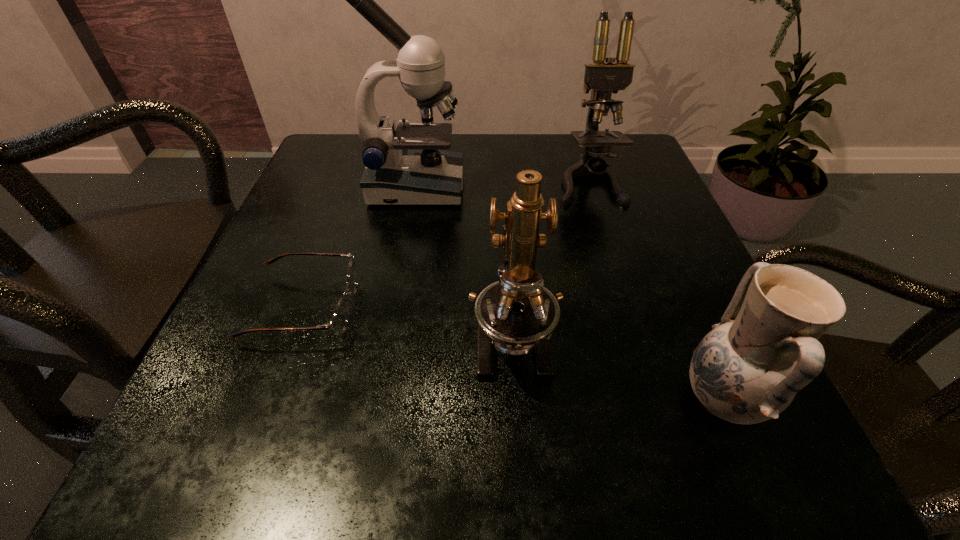
The image size is (960, 540). I want to click on the second closest object relative to the shortest object, so click(x=517, y=314).

Locate which microscope ranks second in proximity to the leftmost microscope. Please provide its 2D coordinates. Your answer should be formatted as a tuple, i.e. [(x, y)], where the tuple contains the x and y coordinates of a point satisfying the conditions above.

[(517, 314)]

Where is `the second closest microscope relative to the nearest microscope`? the second closest microscope relative to the nearest microscope is located at coordinates (603, 79).

Where is `vacant space that satisfies the following two spatial constraints: 1. at the eyepieces of the rightmost microscope; 2. at the eyepiece of the tallest microscope`? The width and height of the screenshot is (960, 540). vacant space that satisfies the following two spatial constraints: 1. at the eyepieces of the rightmost microscope; 2. at the eyepiece of the tallest microscope is located at coordinates (590, 187).

At what (x,y) coordinates should I click in order to perform the action: click on vacant area that satisfies the following two spatial constraints: 1. at the eyepieces of the rightmost microscope; 2. at the eyepiece of the tallest microscope. Please return your answer as a coordinate pair (x, y). Image resolution: width=960 pixels, height=540 pixels. Looking at the image, I should click on (590, 187).